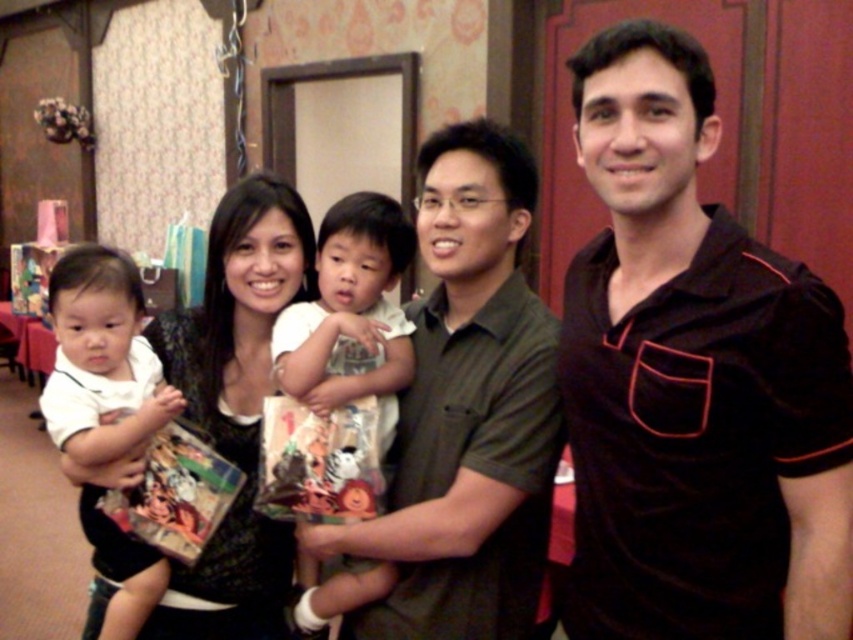
Question: Which of the following is the closest to the observer?

Choices:
 (A) (80, 524)
 (B) (131, 461)
 (C) (416, 332)
 (D) (682, 312)

Answer: (D)

Question: Does black velvety shirt at center have a smaller size compared to white cotton shirt at center?

Choices:
 (A) yes
 (B) no

Answer: (B)

Question: Which of the following is the closest to the observer?

Choices:
 (A) black textured dress at center
 (B) black velvety shirt at center

Answer: (B)

Question: Can you confirm if black textured dress at center is wider than white cotton shirt at center?

Choices:
 (A) no
 (B) yes

Answer: (B)

Question: Estimate the real-world distances between objects in this image. Which object is closer to the black textured dress at center?

Choices:
 (A) white cotton shirt at center
 (B) dark green shirt at center
 (C) black velvety shirt at center

Answer: (A)

Question: Observing the image, what is the correct spatial positioning of black velvety shirt at center in reference to white matte shirt at center?

Choices:
 (A) below
 (B) above

Answer: (B)